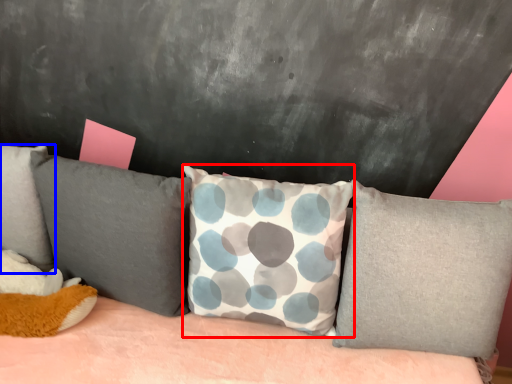
Question: Which object appears closest to the camera in this image, pillow (highlighted by a red box) or pillow (highlighted by a blue box)?

Choices:
 (A) pillow
 (B) pillow

Answer: (A)